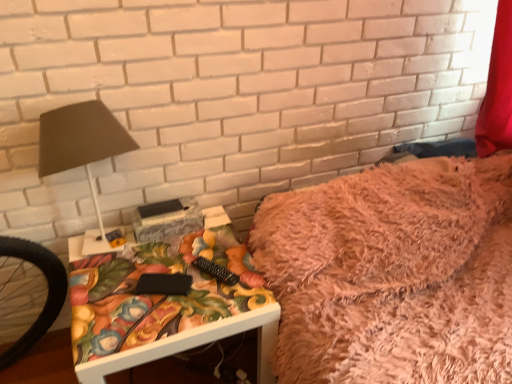
Question: Considering the relative sizes of fuzzy pink blanket at upper right and white glossy table at lower left in the image provided, is fuzzy pink blanket at upper right thinner than white glossy table at lower left?

Choices:
 (A) no
 (B) yes

Answer: (A)

Question: From the image's perspective, is fuzzy pink blanket at upper right located beneath white glossy table at lower left?

Choices:
 (A) yes
 (B) no

Answer: (B)

Question: Is fuzzy pink blanket at upper right placed right next to white glossy table at lower left?

Choices:
 (A) yes
 (B) no

Answer: (B)

Question: Considering the relative sizes of fuzzy pink blanket at upper right and white glossy table at lower left in the image provided, is fuzzy pink blanket at upper right smaller than white glossy table at lower left?

Choices:
 (A) yes
 (B) no

Answer: (A)

Question: Is fuzzy pink blanket at upper right oriented away from white glossy table at lower left?

Choices:
 (A) no
 (B) yes

Answer: (A)

Question: Is fuzzy pink blanket at upper right to the left or to the right of matte black lamp at left in the image?

Choices:
 (A) right
 (B) left

Answer: (A)

Question: Does point (504, 175) appear closer or farther from the camera than point (95, 102)?

Choices:
 (A) closer
 (B) farther

Answer: (B)

Question: From a real-world perspective, is fuzzy pink blanket at upper right physically located above or below matte black lamp at left?

Choices:
 (A) above
 (B) below

Answer: (B)

Question: From their relative heights in the image, would you say fuzzy pink blanket at upper right is taller or shorter than matte black lamp at left?

Choices:
 (A) short
 (B) tall

Answer: (A)

Question: Based on their positions, is fuzzy pink blanket at upper right located to the left or right of white glossy table at lower left?

Choices:
 (A) left
 (B) right

Answer: (B)

Question: Based on their sizes in the image, would you say fuzzy pink blanket at upper right is bigger or smaller than white glossy table at lower left?

Choices:
 (A) big
 (B) small

Answer: (B)

Question: Which is correct: fuzzy pink blanket at upper right is inside white glossy table at lower left, or outside of it?

Choices:
 (A) outside
 (B) inside

Answer: (A)

Question: From the image's perspective, relative to white glossy table at lower left, is fuzzy pink blanket at upper right above or below?

Choices:
 (A) above
 (B) below

Answer: (A)

Question: Choose the correct answer: Is white glossy table at lower left inside matte black lamp at left or outside it?

Choices:
 (A) outside
 (B) inside

Answer: (A)

Question: Looking at their shapes, would you say white glossy table at lower left is wider or thinner than matte black lamp at left?

Choices:
 (A) wide
 (B) thin

Answer: (A)